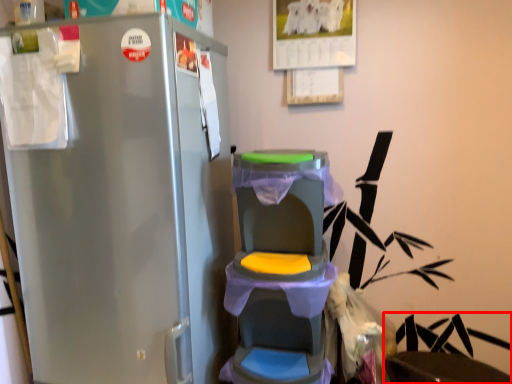
Question: Where is swivel chair (annotated by the red box) located in relation to baby carriage in the image?

Choices:
 (A) left
 (B) right

Answer: (B)